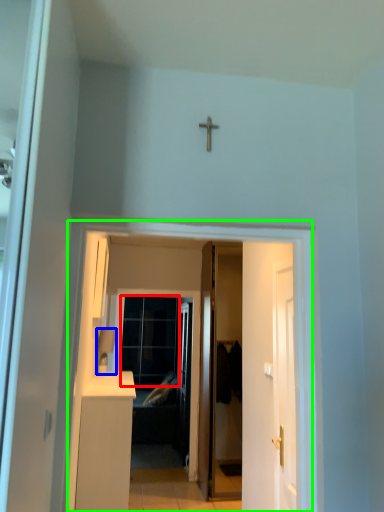
Question: Estimate the real-world distances between objects in this image. Which object is closer to glass door (highlighted by a red box), lamp (highlighted by a blue box) or corridor (highlighted by a green box)?

Choices:
 (A) lamp
 (B) corridor

Answer: (A)